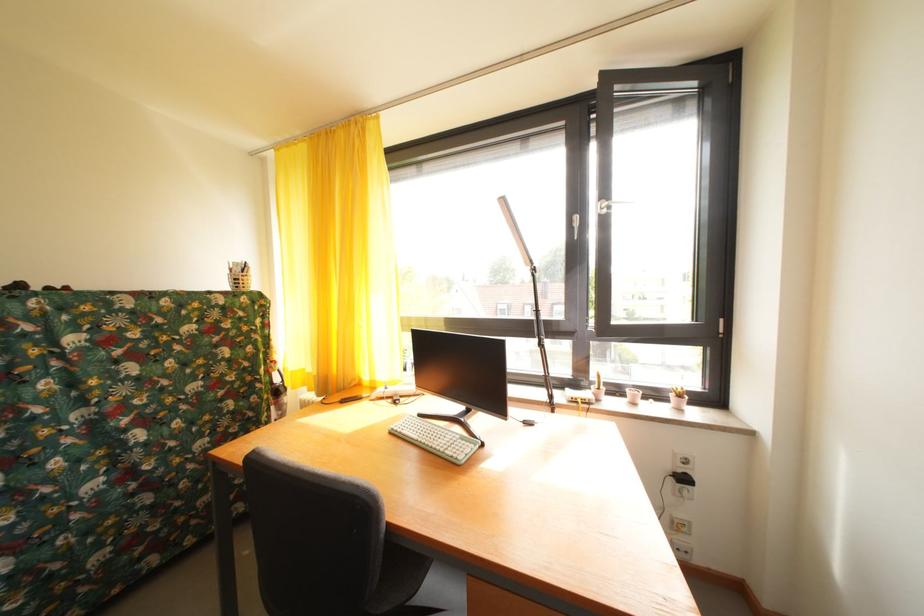
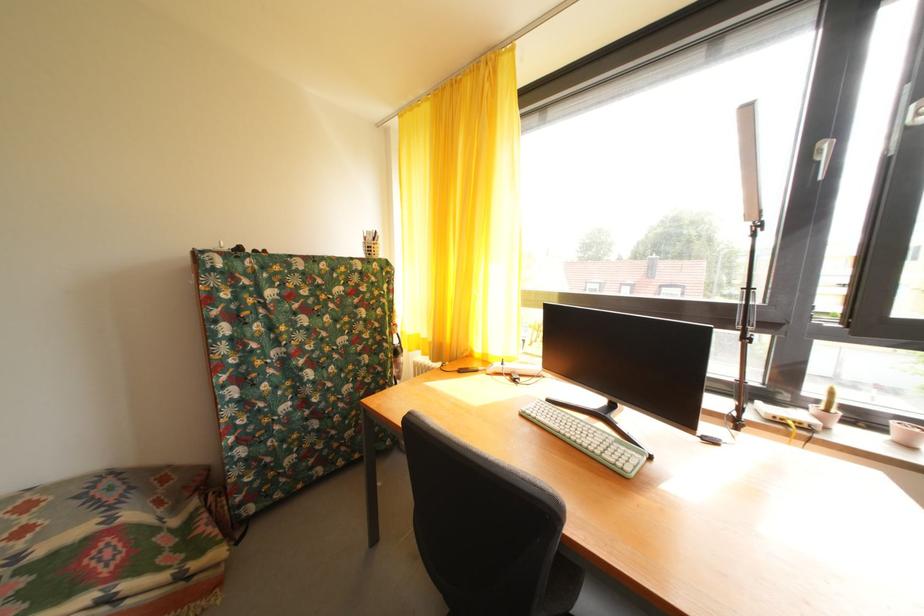
Locate, in the second image, the point that corresponds to pixel 637 397 in the first image.

(904, 430)